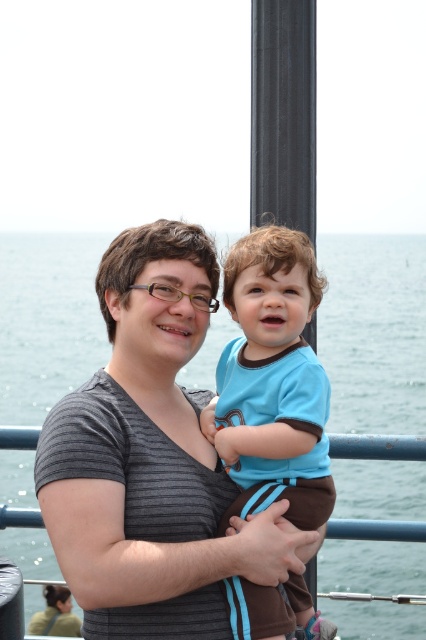
Is point (66, 276) in front of point (268, 397)?

No, (66, 276) is behind (268, 397).

I want to click on blue water at center, so click(374, 332).